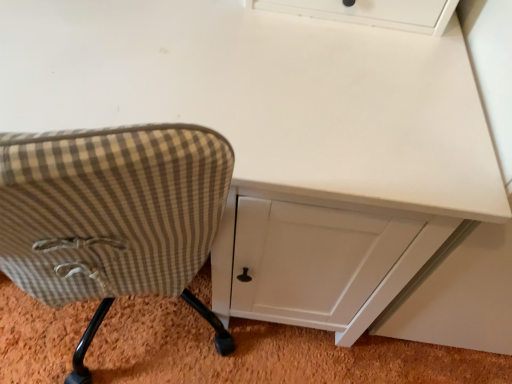
Where is `brown checkered fabric chair at left`? The height and width of the screenshot is (384, 512). brown checkered fabric chair at left is located at coordinates (112, 216).

What do you see at coordinates (112, 216) in the screenshot? The width and height of the screenshot is (512, 384). I see `brown checkered fabric chair at left` at bounding box center [112, 216].

What are the coordinates of `brown checkered fabric chair at left` in the screenshot? It's located at (112, 216).